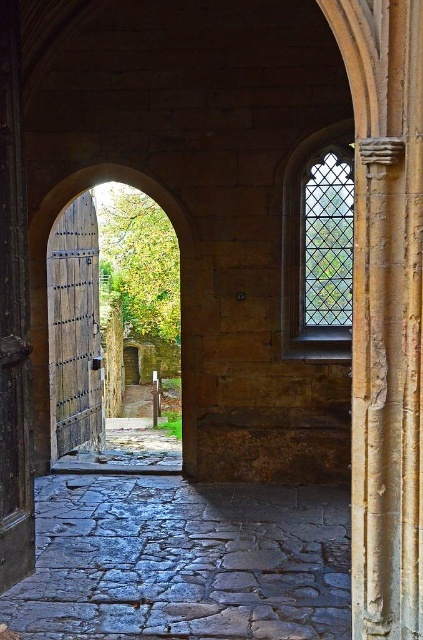
Does green stained glass window at upper right appear on the right side of wooden door at center?

Yes, green stained glass window at upper right is to the right of wooden door at center.

Is point (342, 163) positioned after point (54, 353)?

No, it is in front of (54, 353).

At what (x,y) coordinates should I click in order to perform the action: click on green stained glass window at upper right. Please return your answer as a coordinate pair (x, y). Image resolution: width=423 pixels, height=640 pixels. Looking at the image, I should click on (318, 246).

Consider the image. Which is above, wooden door at center or wooden gate at center?

wooden gate at center is higher up.

Does point (73, 339) come in front of point (76, 172)?

No, (73, 339) is further to viewer.

Who is more forward, (87, 429) or (33, 314)?

Positioned in front is point (33, 314).

This screenshot has width=423, height=640. I want to click on wooden door at center, so click(x=74, y=330).

Can you confirm if green stained glass window at upper right is shorter than wooden gate at center?

Yes.

Does green stained glass window at upper right lie behind wooden gate at center?

No, green stained glass window at upper right is in front of wooden gate at center.

Does point (315, 195) come behind point (38, 230)?

Yes, it is behind point (38, 230).

Where is `green stained glass window at upper right`? green stained glass window at upper right is located at coordinates (318, 246).